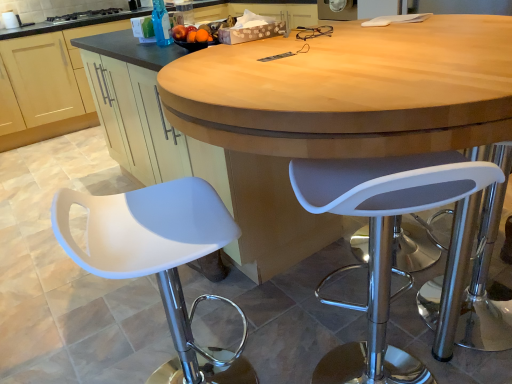
Question: Can you confirm if white matte stool at left, the 2th chair positioned from the right, is wider than white plastic stool at right, marked as the 2th chair in a left-to-right arrangement?

Choices:
 (A) no
 (B) yes

Answer: (B)

Question: From the image's perspective, is white matte stool at left, the 2th chair positioned from the right, located above white plastic stool at right, which is counted as the 1th chair, starting from the right?

Choices:
 (A) yes
 (B) no

Answer: (B)

Question: Considering the relative sizes of white matte stool at left, the 2th chair positioned from the right, and white plastic stool at right, which is counted as the 1th chair, starting from the right, in the image provided, is white matte stool at left, the 2th chair positioned from the right, shorter than white plastic stool at right, which is counted as the 1th chair, starting from the right,?

Choices:
 (A) no
 (B) yes

Answer: (B)

Question: Are white matte stool at left, positioned as the first chair in left-to-right order, and white plastic stool at right, marked as the 2th chair in a left-to-right arrangement, located far from each other?

Choices:
 (A) no
 (B) yes

Answer: (A)

Question: Is white matte stool at left, the 2th chair positioned from the right, facing towards white plastic stool at right, which is counted as the 1th chair, starting from the right?

Choices:
 (A) no
 (B) yes

Answer: (B)

Question: From their relative heights in the image, would you say black glass stove at upper left is taller or shorter than matte wood cabinet at lower left?

Choices:
 (A) short
 (B) tall

Answer: (A)

Question: Is black glass stove at upper left bigger or smaller than matte wood cabinet at lower left?

Choices:
 (A) big
 (B) small

Answer: (B)

Question: Is black glass stove at upper left in front of or behind matte wood cabinet at lower left in the image?

Choices:
 (A) behind
 (B) front

Answer: (A)

Question: Considering the relative positions of black glass stove at upper left and matte wood cabinet at lower left in the image provided, is black glass stove at upper left to the left or to the right of matte wood cabinet at lower left?

Choices:
 (A) right
 (B) left

Answer: (B)

Question: Based on their positions, is transparent plastic bottle at upper center located to the left or right of white plastic stool at right, marked as the 2th chair in a left-to-right arrangement?

Choices:
 (A) right
 (B) left

Answer: (B)

Question: Is transparent plastic bottle at upper center taller or shorter than white plastic stool at right, which is counted as the 1th chair, starting from the right?

Choices:
 (A) short
 (B) tall

Answer: (A)

Question: Considering the positions of point (163, 41) and point (366, 163), is point (163, 41) closer or farther from the camera than point (366, 163)?

Choices:
 (A) closer
 (B) farther

Answer: (B)

Question: Relative to white plastic stool at right, marked as the 2th chair in a left-to-right arrangement, is transparent plastic bottle at upper center in front or behind?

Choices:
 (A) front
 (B) behind

Answer: (B)

Question: Considering the positions of white plastic stool at right, marked as the 2th chair in a left-to-right arrangement, and black glass stove at upper left in the image, is white plastic stool at right, marked as the 2th chair in a left-to-right arrangement, wider or thinner than black glass stove at upper left?

Choices:
 (A) wide
 (B) thin

Answer: (B)

Question: Is point (378, 221) positioned closer to the camera than point (72, 21)?

Choices:
 (A) farther
 (B) closer

Answer: (B)